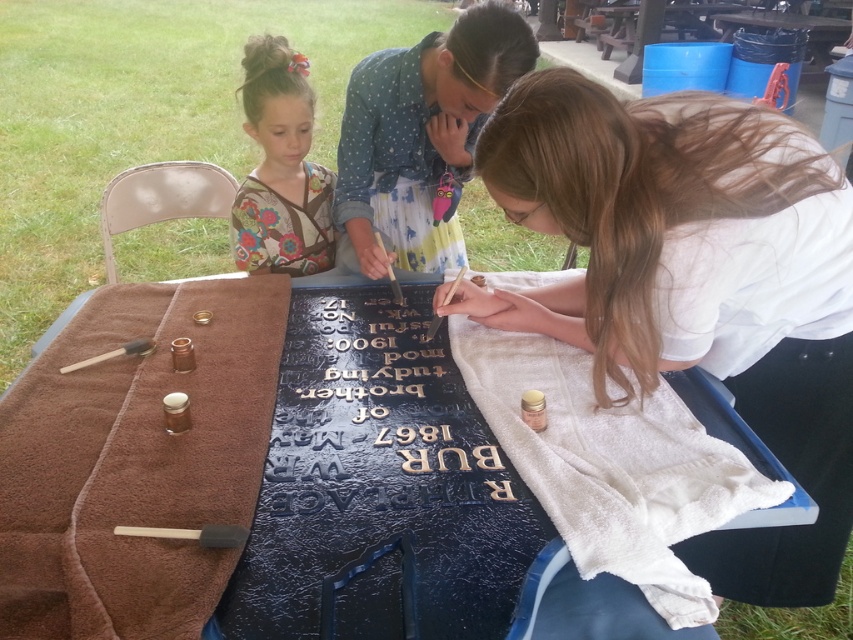
Does matte white shirt at center appear on the left side of gold embossed letters at center?

Incorrect, matte white shirt at center is not on the left side of gold embossed letters at center.

Does matte white shirt at center appear on the right side of gold embossed letters at center?

Yes, matte white shirt at center is to the right of gold embossed letters at center.

Locate an element on the screen. This screenshot has height=640, width=853. matte white shirt at center is located at coordinates pos(695,284).

Does blue textured tablecloth at center have a lesser width compared to gold embossed letters at center?

Incorrect, blue textured tablecloth at center's width is not less than gold embossed letters at center's.

Is blue textured tablecloth at center positioned at the back of gold embossed letters at center?

No, blue textured tablecloth at center is in front of gold embossed letters at center.

Between point (397, 346) and point (397, 378), which one is positioned in front?

Point (397, 378) is more forward.

This screenshot has width=853, height=640. Find the location of `blue textured tablecloth at center`. blue textured tablecloth at center is located at coordinates (363, 492).

Can you confirm if blue textured tablecloth at center is positioned above matte white shirt at center?

No.

Is blue textured tablecloth at center taller than matte white shirt at center?

Incorrect, blue textured tablecloth at center's height is not larger of matte white shirt at center's.

Measure the distance between blue textured tablecloth at center and camera.

A distance of 27.93 inches exists between blue textured tablecloth at center and camera.

This screenshot has width=853, height=640. In order to click on blue textured tablecloth at center in this screenshot , I will do `click(363, 492)`.